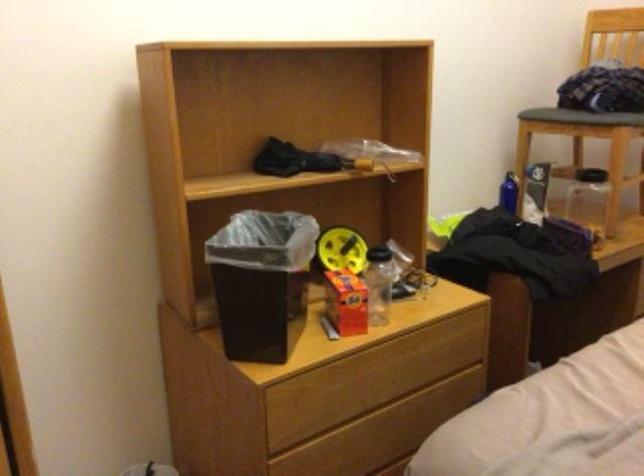
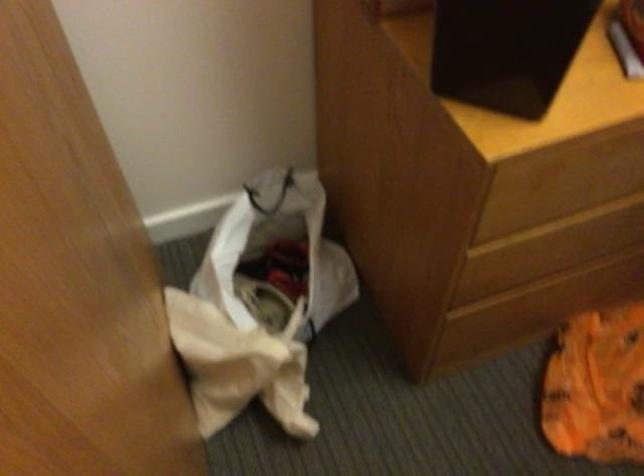
Question: Based on the continuous images, in which direction is the camera rotating? Reply with the corresponding letter.

Choices:
 (A) Left
 (B) Right
 (C) Up
 (D) Down

Answer: (D)